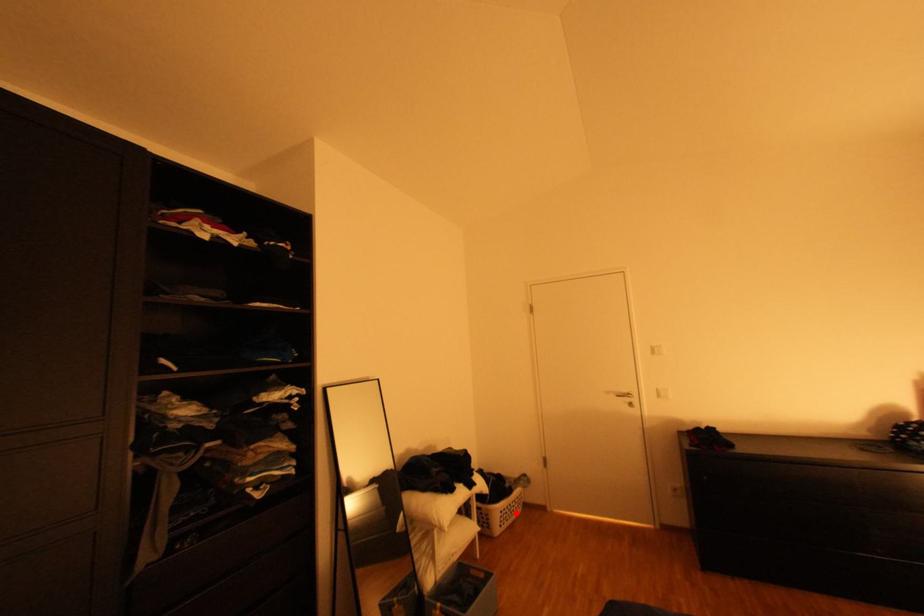
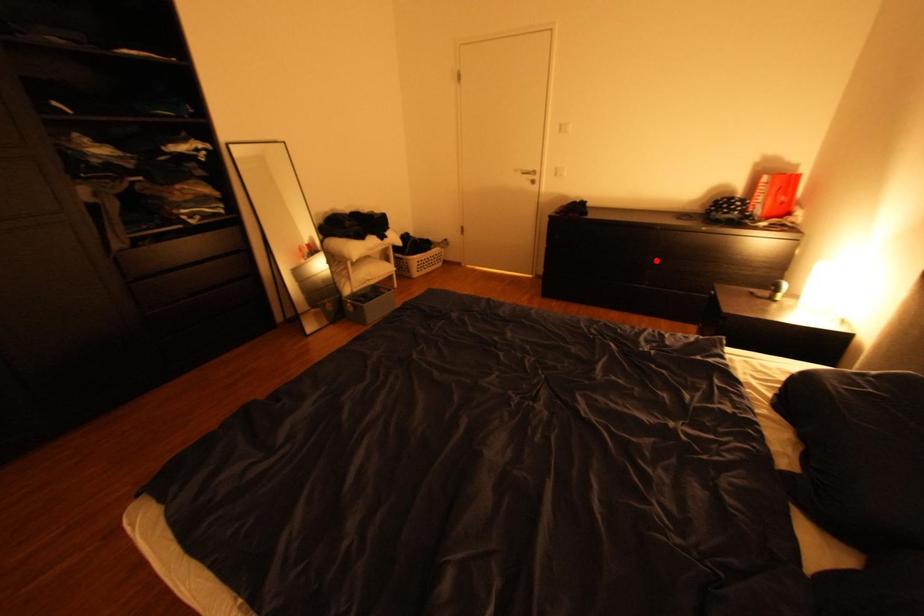
I am providing you with two images of the same scene from different viewpoints. A red point is marked on the first image and another point is marked on the second image. Are the points marked in image1 and image2 representing the same 3D position?

No